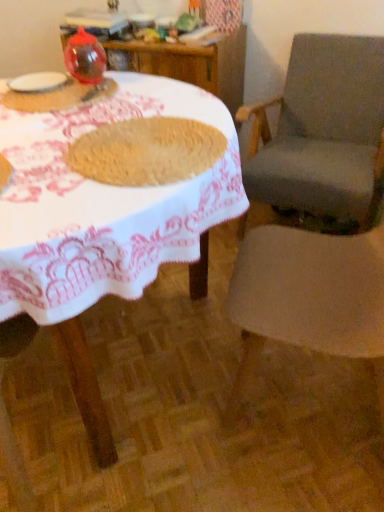
Question: Does white woven table at center have a greater height compared to translucent plastic cup at upper left, which appears as the first tableware when ordered from the bottom?

Choices:
 (A) yes
 (B) no

Answer: (A)

Question: Considering the relative positions of white woven table at center and translucent plastic cup at upper left, which appears as the first tableware when ordered from the bottom, in the image provided, is white woven table at center behind translucent plastic cup at upper left, which appears as the first tableware when ordered from the bottom,?

Choices:
 (A) no
 (B) yes

Answer: (A)

Question: From the image's perspective, is white woven table at center on translucent plastic cup at upper left, which appears as the first tableware when ordered from the bottom?

Choices:
 (A) yes
 (B) no

Answer: (B)

Question: Is white woven table at center closer to camera compared to translucent plastic cup at upper left, the 3th tableware in the top-to-bottom sequence?

Choices:
 (A) no
 (B) yes

Answer: (B)

Question: Is white woven table at center to the right of translucent plastic cup at upper left, which appears as the first tableware when ordered from the bottom, from the viewer's perspective?

Choices:
 (A) yes
 (B) no

Answer: (B)

Question: Is translucent plastic cup at upper left, which appears as the first tableware when ordered from the bottom, in front of or behind brown woven mat at center in the image?

Choices:
 (A) behind
 (B) front

Answer: (A)

Question: Does point (x=84, y=91) appear closer or farther from the camera than point (x=170, y=175)?

Choices:
 (A) closer
 (B) farther

Answer: (B)

Question: Based on their sizes in the image, would you say translucent plastic cup at upper left, which appears as the first tableware when ordered from the bottom, is bigger or smaller than brown woven mat at center?

Choices:
 (A) big
 (B) small

Answer: (B)

Question: Is translucent plastic cup at upper left, the 3th tableware in the top-to-bottom sequence, wider or thinner than brown woven mat at center?

Choices:
 (A) thin
 (B) wide

Answer: (B)

Question: Is brown woven mat at center taller or shorter than translucent plastic cup at upper left, the 3th tableware in the top-to-bottom sequence?

Choices:
 (A) short
 (B) tall

Answer: (B)

Question: Considering the positions of point [x=150, y=183] and point [x=9, y=103], is point [x=150, y=183] closer or farther from the camera than point [x=9, y=103]?

Choices:
 (A) closer
 (B) farther

Answer: (A)

Question: From the image's perspective, is brown woven mat at center positioned above or below translucent plastic cup at upper left, which appears as the first tableware when ordered from the bottom?

Choices:
 (A) above
 (B) below

Answer: (B)

Question: In terms of size, does brown woven mat at center appear bigger or smaller than translucent plastic cup at upper left, the 3th tableware in the top-to-bottom sequence?

Choices:
 (A) big
 (B) small

Answer: (A)

Question: Considering their positions, is transparent plastic balloon at upper left, placed as the third tableware when sorted from bottom to top, located in front of or behind gray fabric chair at right, marked as the first chair in a back-to-front arrangement?

Choices:
 (A) front
 (B) behind

Answer: (A)

Question: Visually, is transparent plastic balloon at upper left, which is counted as the 1th tableware, starting from the top, positioned to the left or to the right of gray fabric chair at right, which ranks as the 2th chair in front-to-back order?

Choices:
 (A) left
 (B) right

Answer: (A)